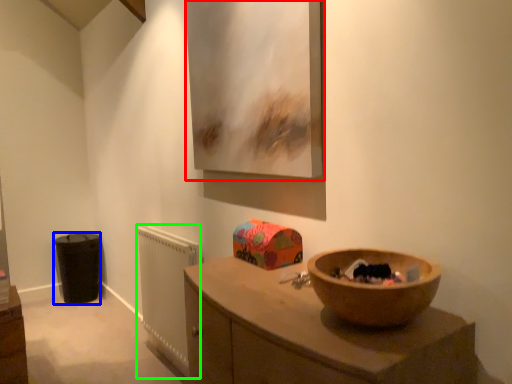
Question: Considering the real-world distances, which object is closest to picture frame (highlighted by a red box)? cabinetry (highlighted by a blue box) or radiator (highlighted by a green box).

Choices:
 (A) cabinetry
 (B) radiator

Answer: (B)